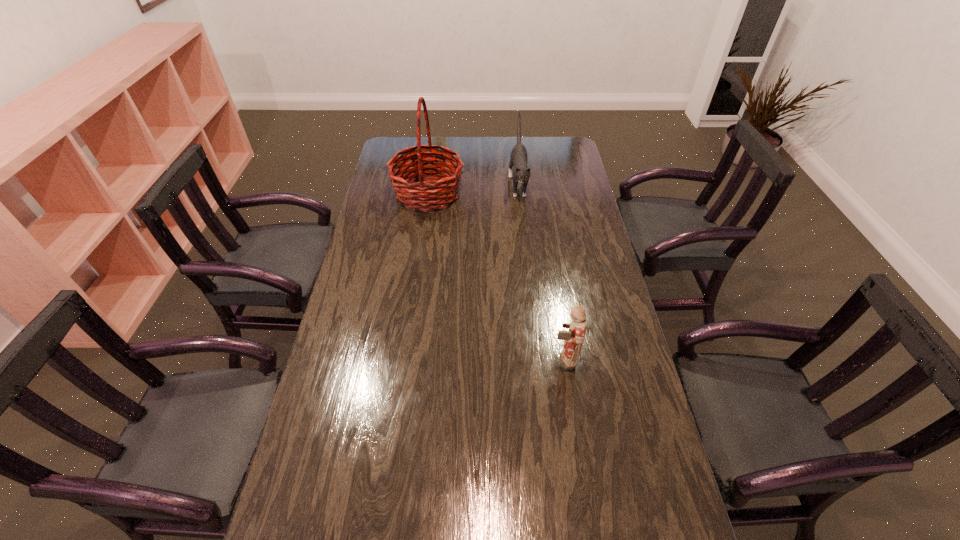
The height and width of the screenshot is (540, 960). I want to click on free area in between the basket and the nearest object, so click(x=495, y=277).

Image resolution: width=960 pixels, height=540 pixels. Find the location of `the second closest object to the basket`. the second closest object to the basket is located at coordinates (574, 337).

Identify the location of object that stands as the closest to the cat. The image size is (960, 540). (418, 194).

Where is `free point that satisfies the following two spatial constraints: 1. at the face of the cat; 2. on the handle side of the leftmost object`? This screenshot has height=540, width=960. free point that satisfies the following two spatial constraints: 1. at the face of the cat; 2. on the handle side of the leftmost object is located at coordinates tap(519, 194).

Locate an element on the screen. The image size is (960, 540). vacant space that satisfies the following two spatial constraints: 1. at the face of the cat; 2. on the handle side of the tallest object is located at coordinates (519, 194).